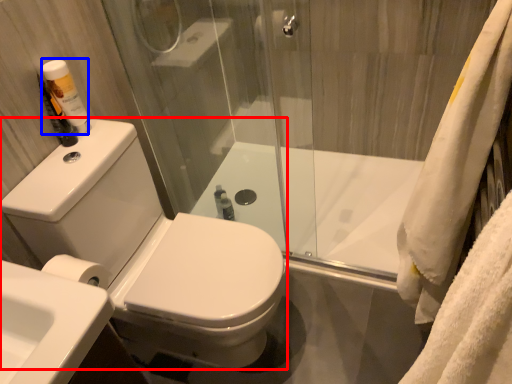
Question: Which of the following is the farthest to the observer, porcelain (highlighted by a red box) or toiletry (highlighted by a blue box)?

Choices:
 (A) porcelain
 (B) toiletry

Answer: (B)